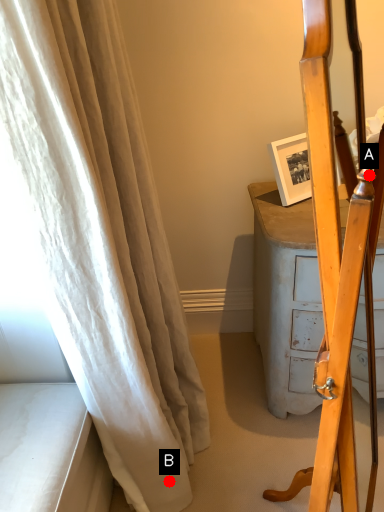
Question: Two points are circled on the image, labeled by A and B beside each circle. Which of the following is the closest to the observer?

Choices:
 (A) A is closer
 (B) B is closer

Answer: (A)